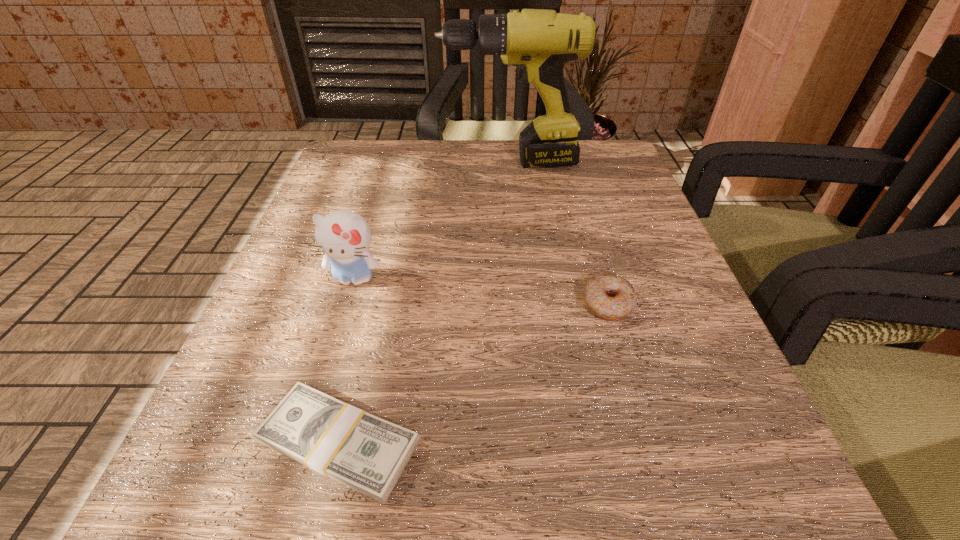
Identify the location of vacant region located 0.250m on the back of the second shortest object. The width and height of the screenshot is (960, 540). (576, 196).

Image resolution: width=960 pixels, height=540 pixels. I want to click on vacant space situated 0.320m on the right of the nearest object, so click(x=705, y=442).

At what (x,y) coordinates should I click in order to perform the action: click on object present at the far edge. Please return your answer as a coordinate pair (x, y). Looking at the image, I should click on (539, 42).

Find the location of a particular element. object present at the near edge is located at coordinates (368, 454).

Find the location of a particular element. Image resolution: width=960 pixels, height=540 pixels. kitten at the left edge is located at coordinates 344,236.

Locate an element on the screen. The image size is (960, 540). dollar located at the left edge is located at coordinates (368, 454).

Where is `drill at the right edge`? drill at the right edge is located at coordinates (539, 42).

You are a GUI agent. You are given a task and a screenshot of the screen. Output one action in this format:
    pyautogui.click(x=<x>, y=<y>)
    Task: Click on the doughnut present at the right edge
    
    Given the screenshot: What is the action you would take?
    pyautogui.click(x=609, y=296)

The width and height of the screenshot is (960, 540). In order to click on object that is positioned at the near left corner in this screenshot , I will do `click(368, 454)`.

This screenshot has height=540, width=960. What are the coordinates of `object at the far right corner` in the screenshot? It's located at (539, 42).